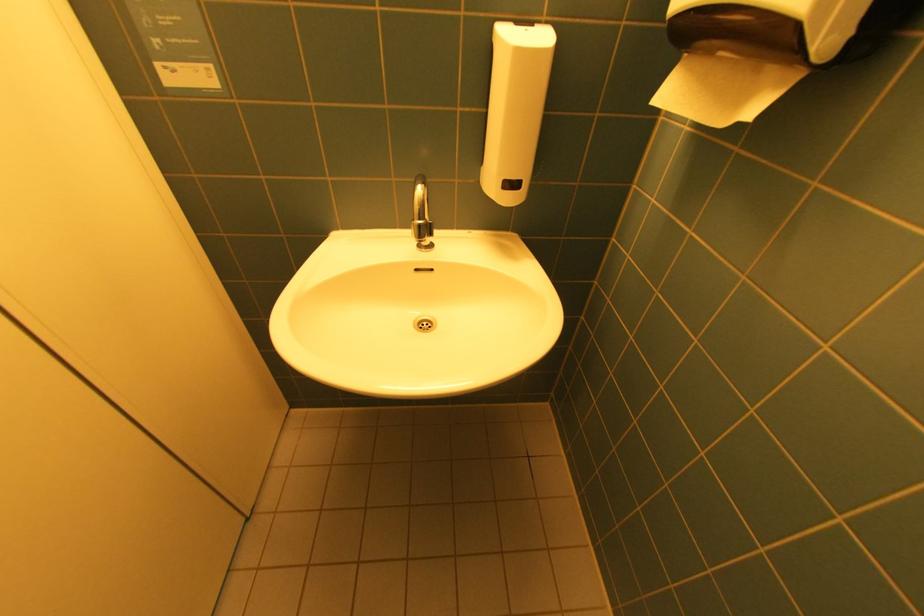
Which object does [723,87] point to?

This point indicates the paper towel.